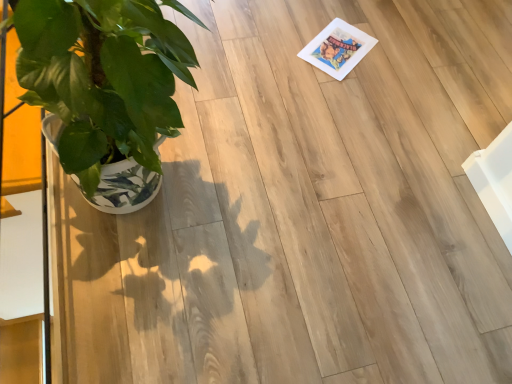
This screenshot has width=512, height=384. Describe the element at coordinates (105, 82) in the screenshot. I see `green glossy plant at left` at that location.

Find the location of a particular element. green glossy plant at left is located at coordinates (105, 82).

Locate an element on the screen. This screenshot has width=512, height=384. green glossy plant at left is located at coordinates (105, 82).